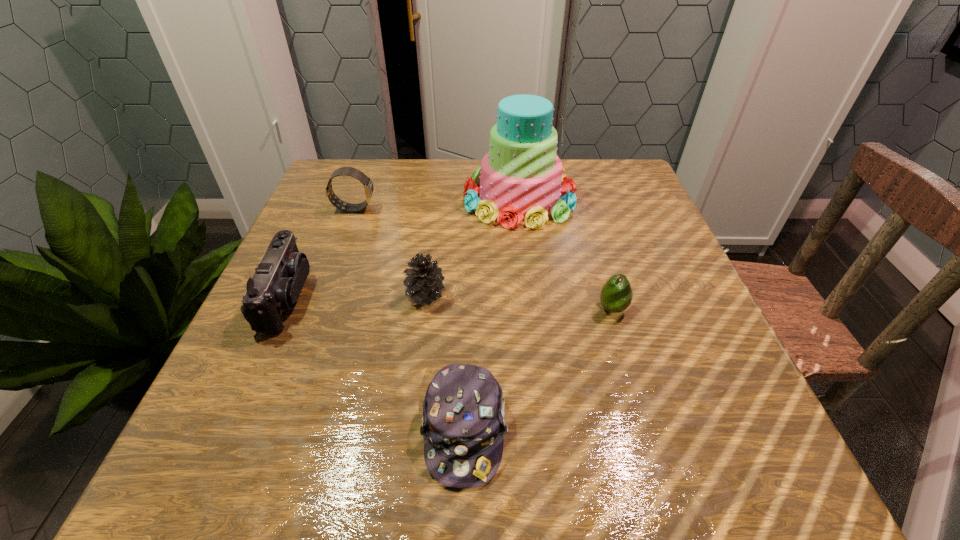
In order to click on blank region between the avocado and the camcorder in this screenshot , I will do `click(449, 303)`.

Locate an element on the screen. This screenshot has height=540, width=960. vacant space that is in between the headwear and the avocado is located at coordinates (539, 369).

Identify the location of empty space that is in between the camcorder and the watch. Image resolution: width=960 pixels, height=540 pixels. (321, 253).

Image resolution: width=960 pixels, height=540 pixels. What are the coordinates of `free spot between the pinecone and the camcorder` in the screenshot? It's located at (356, 296).

Identify which object is the second nearest to the pinecone. Please provide its 2D coordinates. Your answer should be formatted as a tuple, i.e. [(x, y)], where the tuple contains the x and y coordinates of a point satisfying the conditions above.

[(520, 177)]

The image size is (960, 540). I want to click on the fourth closest object relative to the cake, so click(277, 282).

This screenshot has height=540, width=960. Find the location of `vacant position in the image that satisfies the following two spatial constraints: 1. on the back side of the avocado; 2. on the front-facing side of the camcorder`. vacant position in the image that satisfies the following two spatial constraints: 1. on the back side of the avocado; 2. on the front-facing side of the camcorder is located at coordinates (609, 298).

The width and height of the screenshot is (960, 540). In order to click on free space that satisfies the following two spatial constraints: 1. on the front-facing side of the camcorder; 2. on the right side of the avocado in this screenshot , I will do `click(281, 309)`.

The width and height of the screenshot is (960, 540). What are the coordinates of `free region that satisfies the following two spatial constraints: 1. on the face of the watch; 2. on the right side of the pinecone` in the screenshot? It's located at (323, 295).

Find the location of a particular element. This screenshot has width=960, height=540. vacant area that satisfies the following two spatial constraints: 1. on the front side of the cake; 2. on the face of the watch is located at coordinates (520, 208).